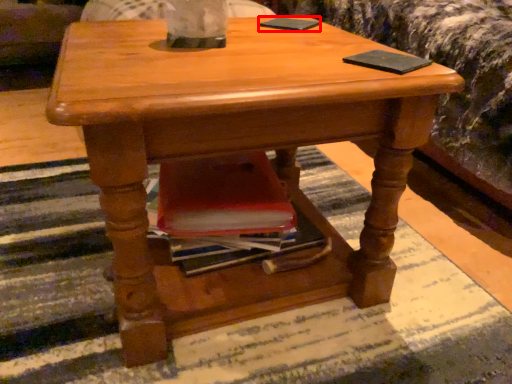
Question: Considering the relative positions of pad (annotated by the red box) and pad in the image provided, where is pad (annotated by the red box) located with respect to the staircase?

Choices:
 (A) left
 (B) right

Answer: (A)